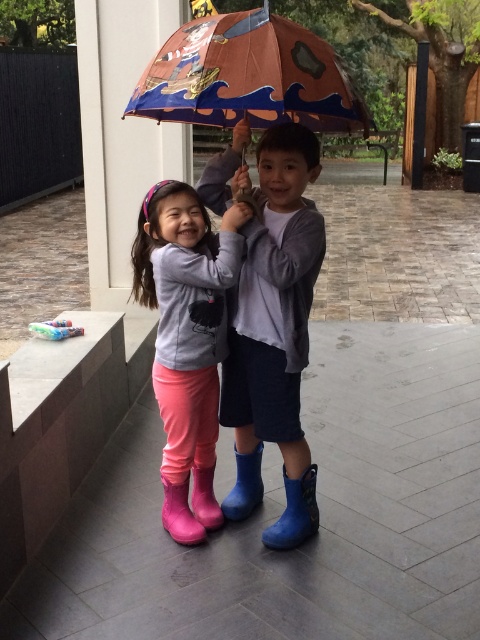
Is blue rubber boot at lower center wider than pink rubber boot at lower center?

Indeed, blue rubber boot at lower center has a greater width compared to pink rubber boot at lower center.

Measure the distance between blue rubber boot at lower center and pink rubber boot at lower center.

12.97 inches

Which is in front, point (294, 508) or point (204, 518)?

Point (294, 508)

Locate an element on the screen. The height and width of the screenshot is (640, 480). blue rubber boot at lower center is located at coordinates point(295,513).

Can you confirm if blue rubber boot at lower center is smaller than rubber boots at lower center?

Incorrect, blue rubber boot at lower center is not smaller in size than rubber boots at lower center.

From the picture: Can you confirm if blue rubber boot at lower center is wider than rubber boots at lower center?

Yes, blue rubber boot at lower center is wider than rubber boots at lower center.

Between point (304, 540) and point (252, 513), which one is positioned behind?

The point (252, 513) is behind.

The width and height of the screenshot is (480, 640). In order to click on blue rubber boot at lower center in this screenshot , I will do `click(295, 513)`.

Who is more distant from viewer, (x=195, y=506) or (x=274, y=531)?

Point (x=195, y=506)

The height and width of the screenshot is (640, 480). What do you see at coordinates (187, 340) in the screenshot?
I see `pink rubber boots at center` at bounding box center [187, 340].

The image size is (480, 640). Find the location of `pink rubber boots at center`. pink rubber boots at center is located at coordinates (187, 340).